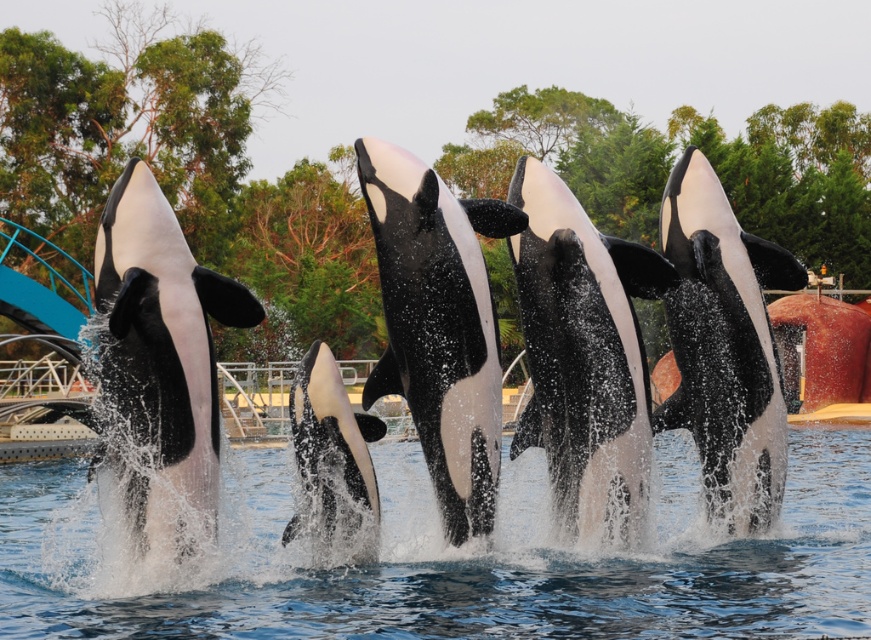
Question: Which of these objects is positioned farthest from the black smooth dolphin at center?

Choices:
 (A) black and white dolphin at center
 (B) black/white dolphin at center

Answer: (B)

Question: Is the position of black smooth dolphin at center less distant than that of black/white smooth dolphin at center?

Choices:
 (A) no
 (B) yes

Answer: (A)

Question: Does black smooth dolphin at center appear on the left side of black/white dolphin at center?

Choices:
 (A) no
 (B) yes

Answer: (A)

Question: Which point is farther from the camera taking this photo?

Choices:
 (A) (397, 289)
 (B) (196, 474)
 (C) (144, 602)
 (D) (669, 317)

Answer: (D)

Question: Which point appears closest to the camera in this image?

Choices:
 (A) (183, 506)
 (B) (584, 305)
 (C) (696, 296)
 (D) (265, 451)

Answer: (A)

Question: Does black smooth dolphin at center appear on the right side of black/white dolphin at center?

Choices:
 (A) no
 (B) yes

Answer: (B)